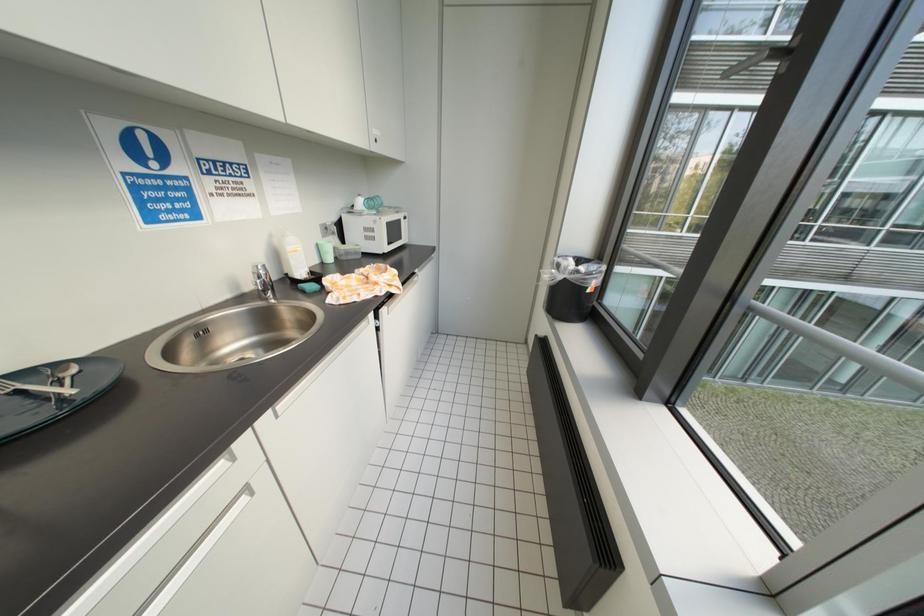
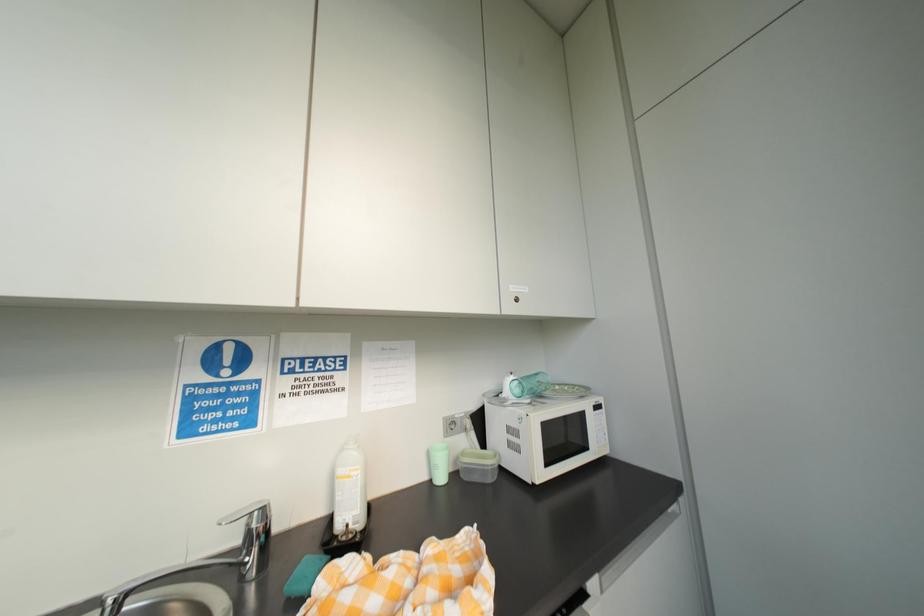
Based on the continuous images, in which direction is the camera rotating?

The camera rotated toward left-up.